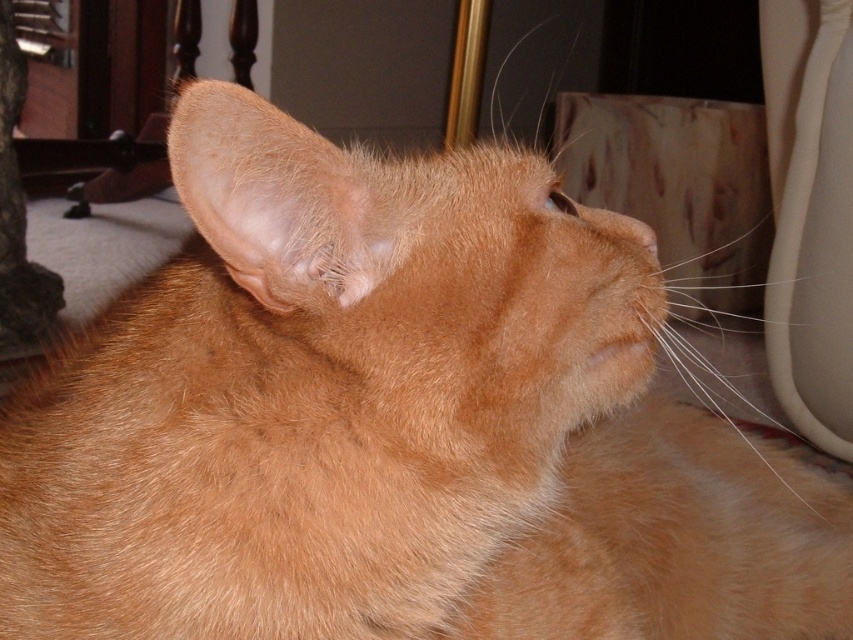
Question: Does orange fur at center appear on the right side of orange fur at upper left?

Choices:
 (A) no
 (B) yes

Answer: (B)

Question: Is the position of orange fur at center less distant than that of orange fur nose at center?

Choices:
 (A) no
 (B) yes

Answer: (B)

Question: Does orange fur at center have a smaller size compared to orange fur nose at center?

Choices:
 (A) yes
 (B) no

Answer: (B)

Question: Which point is closer to the camera?

Choices:
 (A) (260, 150)
 (B) (653, 257)

Answer: (A)

Question: Among these objects, which one is farthest from the camera?

Choices:
 (A) orange fur nose at center
 (B) orange fur at center

Answer: (A)

Question: Considering the real-world distances, which object is closest to the orange fur at upper left?

Choices:
 (A) orange fur nose at center
 (B) orange fur at center

Answer: (B)